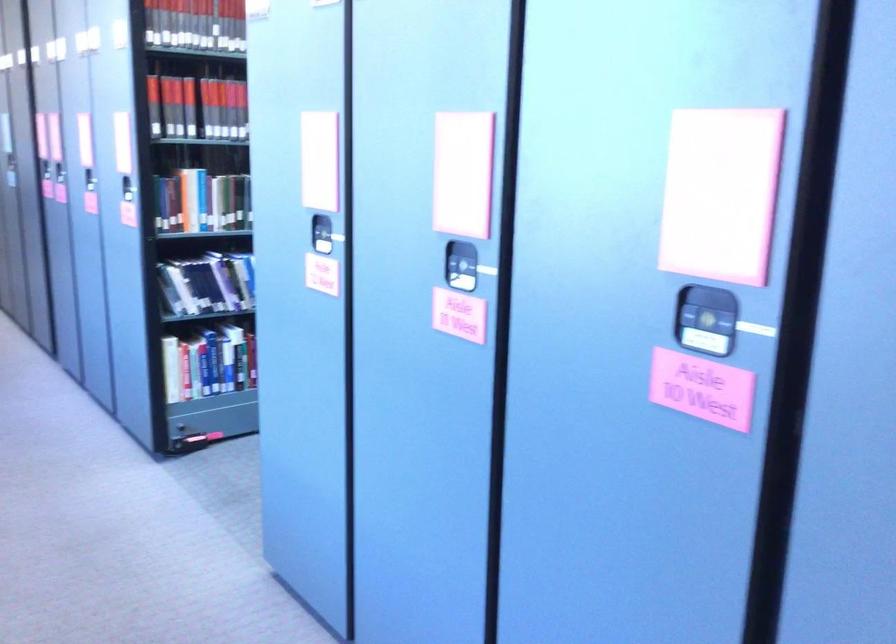
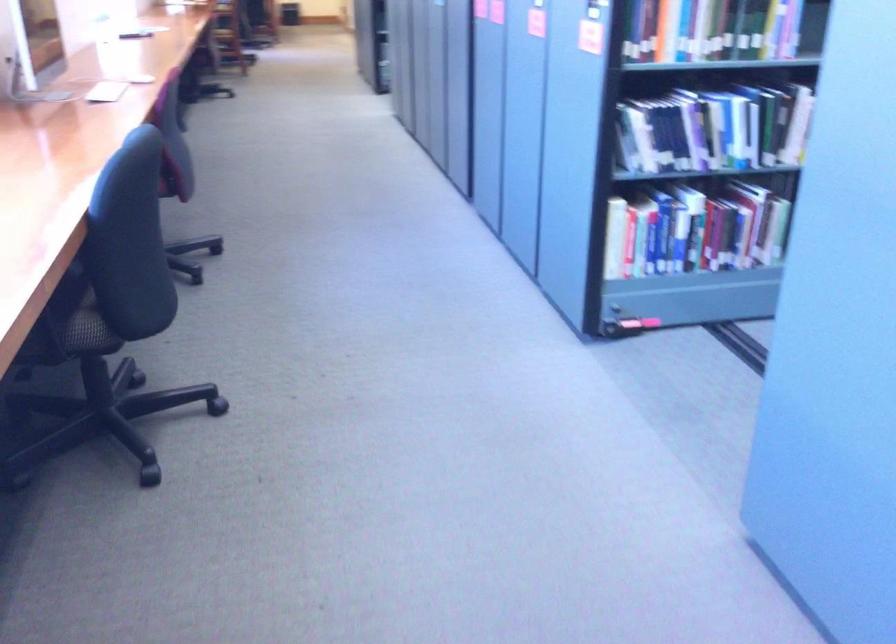
In the second image, find the point that corresponds to pixel 185 368 in the first image.

(630, 242)